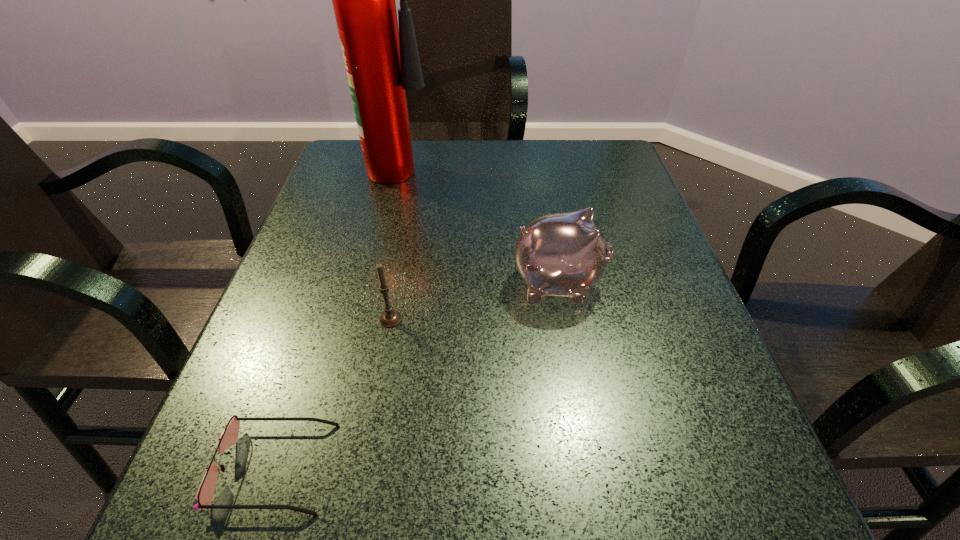
Find the location of a particular element. object that is at the far edge is located at coordinates (382, 62).

This screenshot has height=540, width=960. What are the coordinates of `object that is at the near edge` in the screenshot? It's located at (204, 495).

The height and width of the screenshot is (540, 960). What are the coordinates of `fire extinguisher that is positioned at the left edge` in the screenshot? It's located at (382, 62).

Locate an element on the screen. The height and width of the screenshot is (540, 960). sunglasses that is at the left edge is located at coordinates (204, 495).

The image size is (960, 540). I want to click on object at the right edge, so click(x=563, y=254).

The width and height of the screenshot is (960, 540). Find the location of `object that is positioned at the far left corner`. object that is positioned at the far left corner is located at coordinates (382, 62).

Locate an element on the screen. Image resolution: width=960 pixels, height=540 pixels. object that is at the near left corner is located at coordinates (204, 495).

At what (x,y) coordinates should I click in order to perform the action: click on free location at the far edge of the desktop. Please return your answer as a coordinate pair (x, y). Looking at the image, I should click on coord(480,145).

This screenshot has width=960, height=540. Identify the location of vacant space at the near edge of the desktop. (559, 488).

Identify the location of free space at the right edge of the desktop. The width and height of the screenshot is (960, 540). (702, 424).